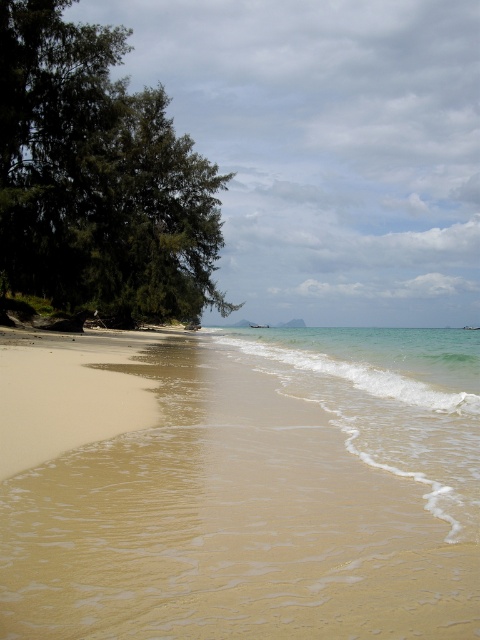
Question: Which point is closer to the camera taking this photo?

Choices:
 (A) (356, 349)
 (B) (416, 547)

Answer: (B)

Question: Which of the following is the closest to the observer?

Choices:
 (A) (440, 493)
 (B) (19, 532)

Answer: (B)

Question: Considering the relative positions of sandy beach at lower left and clear water at lower right in the image provided, where is sandy beach at lower left located with respect to clear water at lower right?

Choices:
 (A) above
 (B) below

Answer: (B)

Question: Which object appears farthest from the camera in this image?

Choices:
 (A) sandy beach at lower left
 (B) clear water at lower right

Answer: (B)

Question: Does sandy beach at lower left come behind clear water at lower right?

Choices:
 (A) no
 (B) yes

Answer: (A)

Question: Is sandy beach at lower left closer to camera compared to clear water at lower right?

Choices:
 (A) no
 (B) yes

Answer: (B)